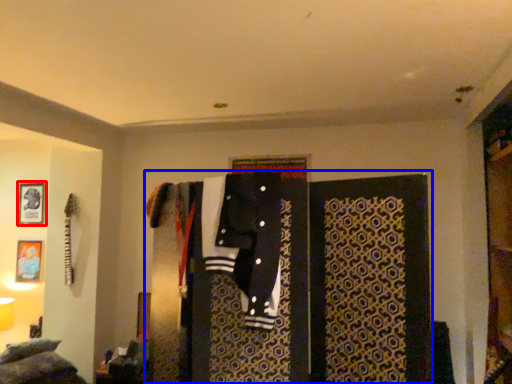
Question: Which of the following is the closest to the observer, picture frame (highlighted by a red box) or closet (highlighted by a blue box)?

Choices:
 (A) picture frame
 (B) closet

Answer: (B)